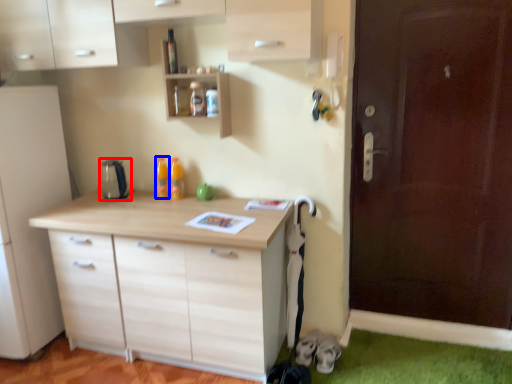
Question: Which point is further to the camera, appliance (highlighted by a red box) or bottle (highlighted by a blue box)?

Choices:
 (A) appliance
 (B) bottle

Answer: (B)